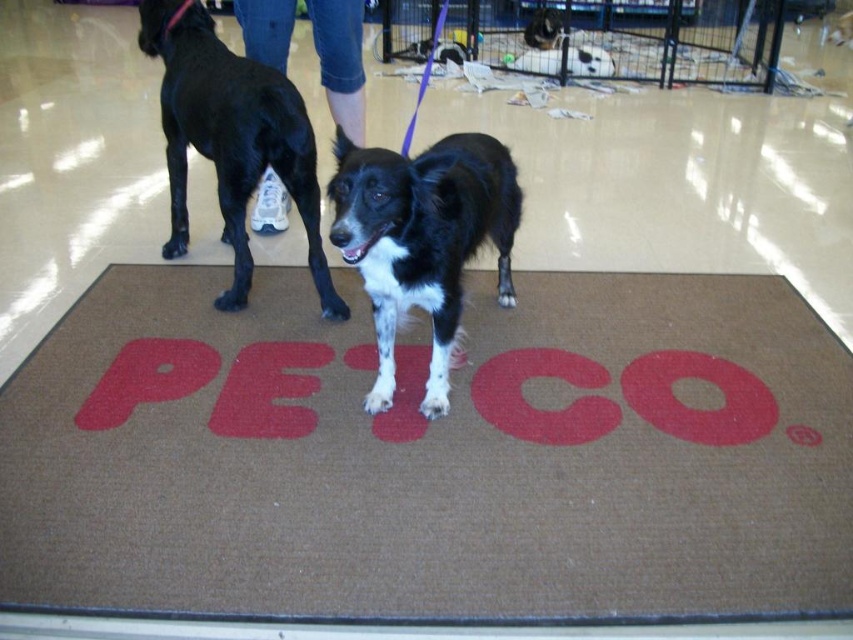
You are a customer entering a pet store and see the brown textured mat at center and jeans at center in the image. Which object is closer to the floor?

The brown textured mat at center is closer to the floor since it is positioned below the jeans at center.

You are a photographer trying to capture a photo of both dogs. Since you want to focus on the black smooth fur dog at left, which is farther away, will the black and white fur at center block your view of it?

The black and white fur at center is closer to the viewer than the black smooth fur dog at left, so it will block your view of the black smooth fur dog at left.

You are a customer in a pet store and see two dogs. The first is the black smooth fur dog at left, and the second is the black and white fur at center. Which dog is positioned to the right of the other?

The black and white fur at center is to the right of the black smooth fur dog at left.